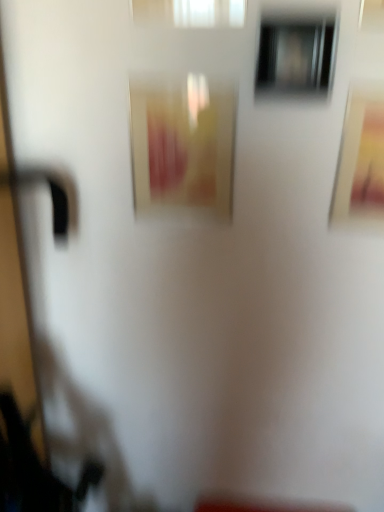
Question: Is matte gold picture frame at upper right, which is the 1th picture frame from right to left, positioned in front of transparent glass window at upper center, the 2th window in the left-to-right sequence?

Choices:
 (A) no
 (B) yes

Answer: (A)

Question: Does matte gold picture frame at upper right, placed as the second picture frame when sorted from left to right, have a greater width compared to transparent glass window at upper center, which appears as the 1th window when ordered from the bottom?

Choices:
 (A) yes
 (B) no

Answer: (B)

Question: Is matte gold picture frame at upper right, placed as the second picture frame when sorted from left to right, far away from transparent glass window at upper center, which appears as the 1th window when ordered from the bottom?

Choices:
 (A) no
 (B) yes

Answer: (A)

Question: Would you say matte gold picture frame at upper right, which is the 1th picture frame from right to left, is outside transparent glass window at upper center, the 2th window in the left-to-right sequence?

Choices:
 (A) yes
 (B) no

Answer: (A)

Question: From the image's perspective, is matte gold picture frame at upper right, which is the 1th picture frame from right to left, below transparent glass window at upper center, the 2th window in the left-to-right sequence?

Choices:
 (A) no
 (B) yes

Answer: (B)

Question: Can you confirm if matte gold picture frame at upper right, which is the 1th picture frame from right to left, is positioned to the right of transparent glass window at upper center, the 2th window in the left-to-right sequence?

Choices:
 (A) yes
 (B) no

Answer: (A)

Question: Does matte yellow picture frame at center, the 1th picture frame positioned from the left, have a greater height compared to white translucent curtain at upper center, acting as the 2th window starting from the bottom?

Choices:
 (A) yes
 (B) no

Answer: (A)

Question: Considering the relative positions of matte yellow picture frame at center, placed as the second picture frame when sorted from right to left, and white translucent curtain at upper center, the 1th window viewed from the top, in the image provided, is matte yellow picture frame at center, placed as the second picture frame when sorted from right to left, in front of white translucent curtain at upper center, the 1th window viewed from the top,?

Choices:
 (A) no
 (B) yes

Answer: (A)

Question: From the image's perspective, would you say matte yellow picture frame at center, the 1th picture frame positioned from the left, is positioned over white translucent curtain at upper center, the 1th window viewed from the top?

Choices:
 (A) yes
 (B) no

Answer: (B)

Question: Can you confirm if matte yellow picture frame at center, the 1th picture frame positioned from the left, is shorter than white translucent curtain at upper center, acting as the 2th window starting from the bottom?

Choices:
 (A) yes
 (B) no

Answer: (B)

Question: Is matte yellow picture frame at center, placed as the second picture frame when sorted from right to left, positioned behind white translucent curtain at upper center, the 1th window viewed from the top?

Choices:
 (A) yes
 (B) no

Answer: (A)

Question: From a real-world perspective, is matte yellow picture frame at center, the 1th picture frame positioned from the left, positioned over white translucent curtain at upper center, which ranks as the second window in right-to-left order, based on gravity?

Choices:
 (A) yes
 (B) no

Answer: (B)

Question: Is matte gold picture frame at upper right, placed as the second picture frame when sorted from left to right, positioned behind matte yellow picture frame at center, placed as the second picture frame when sorted from right to left?

Choices:
 (A) no
 (B) yes

Answer: (A)